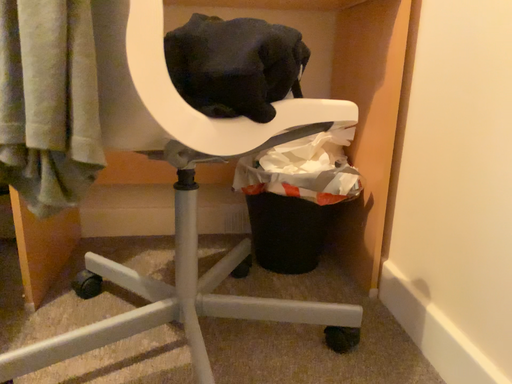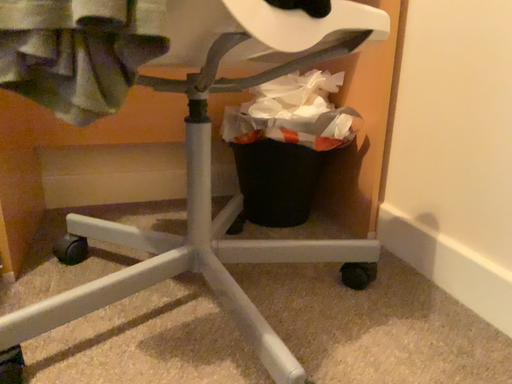
Question: How did the camera likely rotate when shooting the video?

Choices:
 (A) rotated right
 (B) rotated left

Answer: (A)